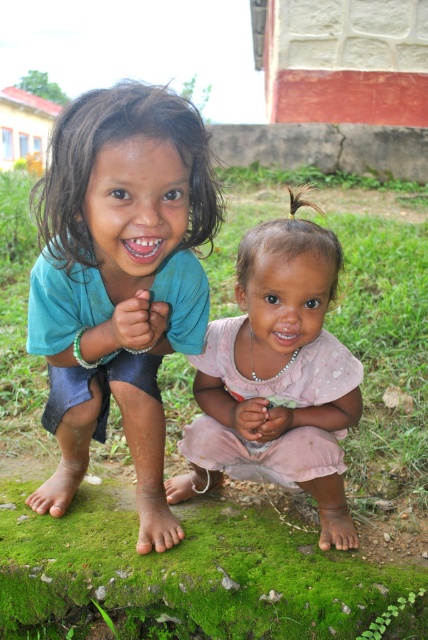
You are a photographer trying to capture a group photo of the blue fabric shirt at left and the pink fabric dress at center. Since you want both subjects to appear at the same height in the photo, which one should you ask to squat lower?

The blue fabric shirt at left is taller than the pink fabric dress at center, so you should ask the blue fabric shirt at left to squat lower to match the height of the pink fabric dress at center.

Based on the scene description, where is the blue fabric shirt at left located in terms of coordinates?

The blue fabric shirt at left is located at point coordinates of (119, 280).

You are a photographer standing at a certain distance from the children. You want to take a photo of the blue fabric shirt at left without including the child on the right. Can you move closer or farther away from the camera position to achieve this?

The blue fabric shirt at left is 3.83 feet away from the camera. To exclude the child on the right, you should move closer to the camera position so that the blue fabric shirt at left fills the frame, leaving the other child out of the shot.